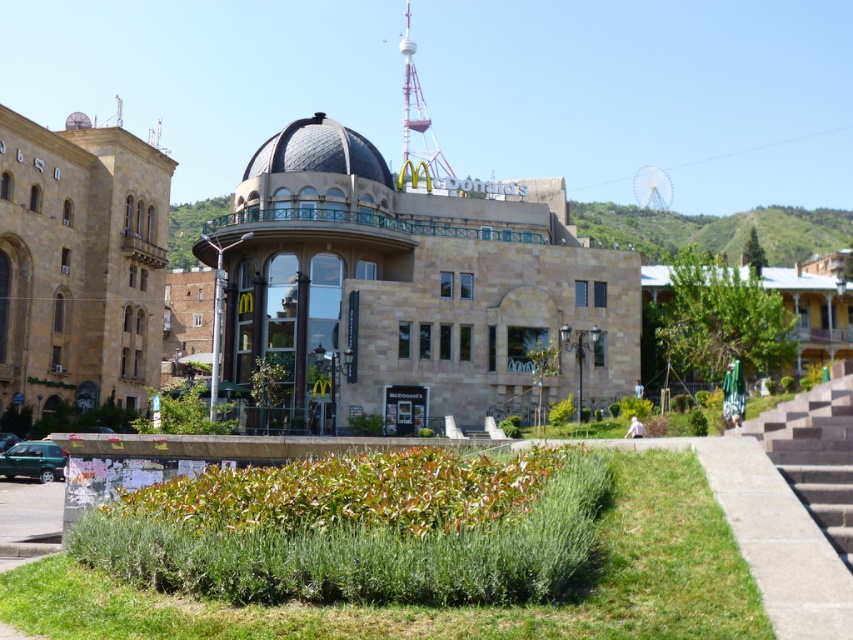
Question: Is concrete stairs at right above shiny metallic dome at center?

Choices:
 (A) no
 (B) yes

Answer: (A)

Question: Is concrete stairs at right positioned before shiny metallic dome at center?

Choices:
 (A) yes
 (B) no

Answer: (A)

Question: Which point is closer to the camera?

Choices:
 (A) (833, 426)
 (B) (293, 138)

Answer: (A)

Question: Can you confirm if concrete stairs at right is wider than shiny metallic dome at center?

Choices:
 (A) yes
 (B) no

Answer: (B)

Question: Which of the following is the farthest from the observer?

Choices:
 (A) concrete stairs at right
 (B) shiny metallic dome at center

Answer: (B)